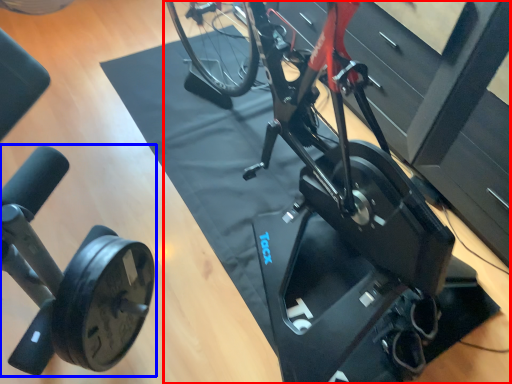
Question: Which object appears farthest to the camera in this image, stationary bicycle (highlighted by a red box) or stationary bicycle (highlighted by a blue box)?

Choices:
 (A) stationary bicycle
 (B) stationary bicycle

Answer: (A)